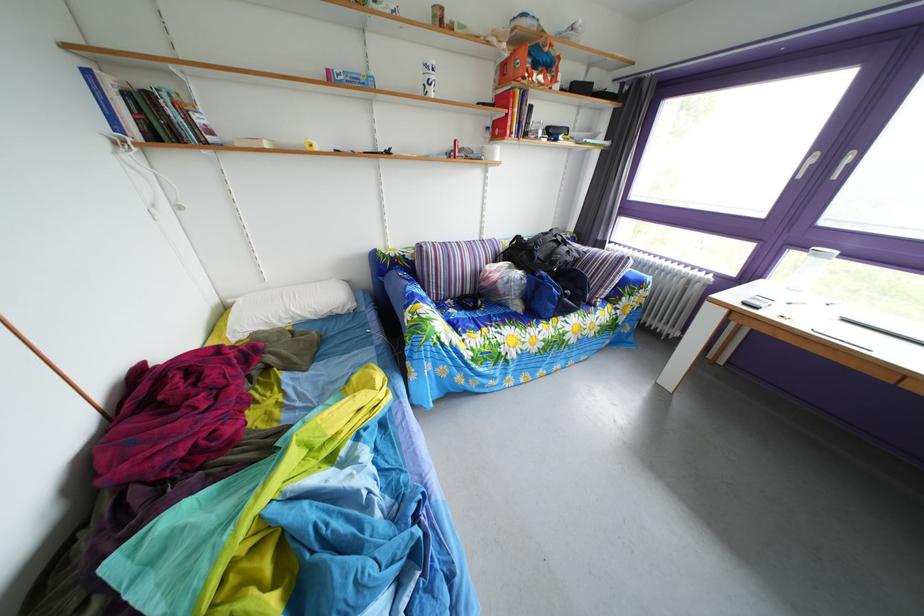
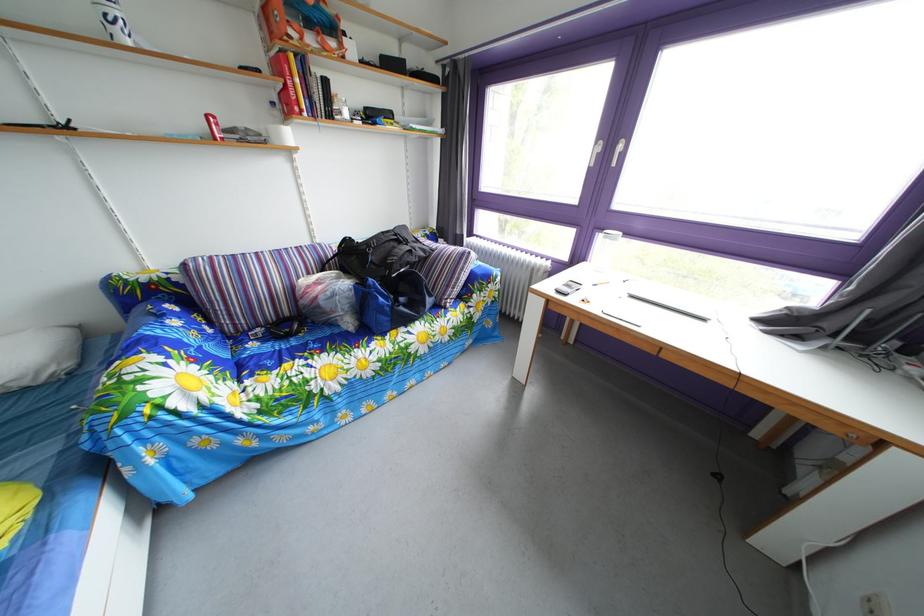
In the second image, find the point that corresponds to point (578, 261) in the first image.

(421, 260)